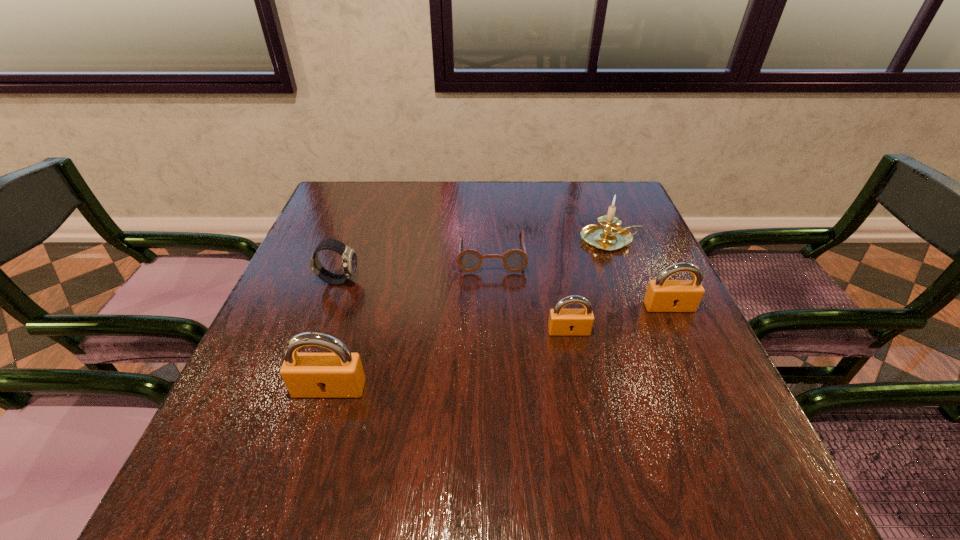
Identify the location of free space that satisfies the following two spatial constraints: 1. on the handle side of the candle holder; 2. to unlock the nearest padlock from the front. (665, 388).

Locate an element on the screen. free spot that satisfies the following two spatial constraints: 1. on the front-facing side of the fourth object from right to left; 2. on the face of the watch is located at coordinates click(x=492, y=280).

Identify the location of free point that satisfies the following two spatial constraints: 1. on the handle side of the candle holder; 2. on the front-facing side of the spectacles. (614, 253).

I want to click on free space that satisfies the following two spatial constraints: 1. on the handle side of the candle holder; 2. to unlock the fifth farthest object from the front, so click(x=643, y=331).

You are a GUI agent. You are given a task and a screenshot of the screen. Output one action in this format:
    pyautogui.click(x=<x>, y=<y>)
    Task: Click on the free point that satisfies the following two spatial constraints: 1. on the front-facing side of the fourth object from right to left; 2. on the face of the watch
    Image resolution: width=960 pixels, height=540 pixels.
    Given the screenshot: What is the action you would take?
    (492, 280)